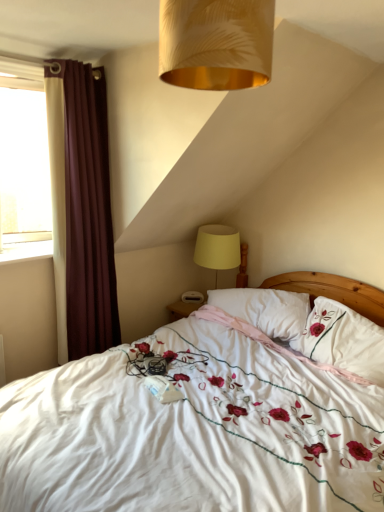
The height and width of the screenshot is (512, 384). Find the location of `white embroidered pillow at upper right, marked as the second pillow in a left-to-right arrangement`. white embroidered pillow at upper right, marked as the second pillow in a left-to-right arrangement is located at coordinates pos(343,340).

Find the location of a particular element. white soft pillow at center, acting as the 2th pillow starting from the right is located at coordinates (265, 309).

Describe the element at coordinates (216, 42) in the screenshot. The width and height of the screenshot is (384, 512). I see `gold textured lampshade at upper center` at that location.

Where is `white embroidered pillow at upper right, marked as the 1th pillow in a right-to-left arrangement`? The image size is (384, 512). white embroidered pillow at upper right, marked as the 1th pillow in a right-to-left arrangement is located at coordinates (343, 340).

I want to click on the 2nd pillow to the right when counting from the white glossy window sill at left, so click(x=343, y=340).

From a real-world perspective, which object stands above the other?

white glossy window sill at left, from a real-world perspective.

Is white glossy window sill at left aimed at white embroidered pillow at upper right, marked as the second pillow in a left-to-right arrangement?

No, white glossy window sill at left is not aimed at white embroidered pillow at upper right, marked as the second pillow in a left-to-right arrangement.

Looking at this image, in the image, is white glossy window sill at left positioned in front of or behind white embroidered pillow at upper right, marked as the 1th pillow in a right-to-left arrangement?

Visually, white glossy window sill at left is located behind white embroidered pillow at upper right, marked as the 1th pillow in a right-to-left arrangement.

From a real-world perspective, who is located lower, yellow fabric lampshade at upper right or white embroidered pillow at upper right, marked as the second pillow in a left-to-right arrangement?

white embroidered pillow at upper right, marked as the second pillow in a left-to-right arrangement.

Is yellow fabric lampshade at upper right oriented towards white embroidered pillow at upper right, marked as the second pillow in a left-to-right arrangement?

No, yellow fabric lampshade at upper right is not oriented towards white embroidered pillow at upper right, marked as the second pillow in a left-to-right arrangement.

From their relative heights in the image, would you say yellow fabric lampshade at upper right is taller or shorter than white embroidered pillow at upper right, marked as the 1th pillow in a right-to-left arrangement?

yellow fabric lampshade at upper right is taller than white embroidered pillow at upper right, marked as the 1th pillow in a right-to-left arrangement.

Do you think yellow fabric lampshade at upper right is within white embroidered pillow at upper right, marked as the second pillow in a left-to-right arrangement, or outside of it?

yellow fabric lampshade at upper right is outside white embroidered pillow at upper right, marked as the second pillow in a left-to-right arrangement.

Is gold textured lampshade at upper center directly adjacent to yellow fabric lampshade at upper right?

They are not placed beside each other.

From the image's perspective, who appears lower, gold textured lampshade at upper center or yellow fabric lampshade at upper right?

From the image's view, yellow fabric lampshade at upper right is below.

Is gold textured lampshade at upper center looking in the opposite direction of yellow fabric lampshade at upper right?

No, gold textured lampshade at upper center is not facing the opposite direction of yellow fabric lampshade at upper right.

Looking at the image, does gold textured lampshade at upper center seem bigger or smaller compared to yellow fabric lampshade at upper right?

Clearly, gold textured lampshade at upper center is smaller in size than yellow fabric lampshade at upper right.

Which object is further away from the camera, white embroidered pillow at upper right, marked as the 1th pillow in a right-to-left arrangement, or white soft pillow at center, acting as the 2th pillow starting from the right?

Positioned behind is white soft pillow at center, acting as the 2th pillow starting from the right.

From the image's perspective, which one is positioned higher, white embroidered pillow at upper right, marked as the second pillow in a left-to-right arrangement, or white soft pillow at center, acting as the 2th pillow starting from the right?

white soft pillow at center, acting as the 2th pillow starting from the right.

At what (x,y) coordinates should I click in order to perform the action: click on pillow below the white embroidered pillow at upper right, marked as the 1th pillow in a right-to-left arrangement (from a real-world perspective). Please return your answer as a coordinate pair (x, y). Image resolution: width=384 pixels, height=512 pixels. Looking at the image, I should click on (265, 309).

From a real-world perspective, who is located higher, white embroidered pillow at upper right, marked as the second pillow in a left-to-right arrangement, or white soft pillow at center, arranged as the first pillow when viewed from the left?

white embroidered pillow at upper right, marked as the second pillow in a left-to-right arrangement, is physically above.

From the image's perspective, which is below, white embroidered pillow at upper right, marked as the second pillow in a left-to-right arrangement, or yellow fabric lampshade at upper right?

white embroidered pillow at upper right, marked as the second pillow in a left-to-right arrangement, is shown below in the image.

From a real-world perspective, which object stands above the other?

From a 3D spatial view, yellow fabric lampshade at upper right is above.

Does point (355, 320) lie in front of point (238, 264)?

Yes, it is in front of point (238, 264).

Is white embroidered pillow at upper right, marked as the 1th pillow in a right-to-left arrangement, touching yellow fabric lampshade at upper right?

No, white embroidered pillow at upper right, marked as the 1th pillow in a right-to-left arrangement, is not with yellow fabric lampshade at upper right.

I want to click on the 2nd pillow to the right of the white embroidered fabric at center, counting from the anchor's position, so click(x=343, y=340).

Is there a large distance between white embroidered pillow at upper right, marked as the 1th pillow in a right-to-left arrangement, and white embroidered fabric at center?

Actually, white embroidered pillow at upper right, marked as the 1th pillow in a right-to-left arrangement, and white embroidered fabric at center are a little close together.

Could you tell me if white embroidered pillow at upper right, marked as the second pillow in a left-to-right arrangement, is facing white embroidered fabric at center?

Yes, white embroidered pillow at upper right, marked as the second pillow in a left-to-right arrangement, is turned towards white embroidered fabric at center.

Does point (352, 324) appear closer or farther from the camera than point (92, 387)?

Point (352, 324).

Is white embroidered pillow at upper right, marked as the second pillow in a left-to-right arrangement, not close to white glossy window sill at left?

Yes, white embroidered pillow at upper right, marked as the second pillow in a left-to-right arrangement, and white glossy window sill at left are quite far apart.

Considering the sizes of objects white embroidered pillow at upper right, marked as the second pillow in a left-to-right arrangement, and white glossy window sill at left in the image provided, who is taller, white embroidered pillow at upper right, marked as the second pillow in a left-to-right arrangement, or white glossy window sill at left?

white embroidered pillow at upper right, marked as the second pillow in a left-to-right arrangement, is taller.

Looking at the image, does white embroidered pillow at upper right, marked as the 1th pillow in a right-to-left arrangement, seem bigger or smaller compared to white glossy window sill at left?

white embroidered pillow at upper right, marked as the 1th pillow in a right-to-left arrangement, is bigger than white glossy window sill at left.

Is white embroidered pillow at upper right, marked as the 1th pillow in a right-to-left arrangement, facing towards white glossy window sill at left?

No, white embroidered pillow at upper right, marked as the 1th pillow in a right-to-left arrangement, is not oriented towards white glossy window sill at left.

Starting from the white glossy window sill at left, which pillow is the 2nd one to the right? Please provide its 2D coordinates.

[(343, 340)]

The image size is (384, 512). I want to click on table lamp on the left of white embroidered pillow at upper right, marked as the second pillow in a left-to-right arrangement, so click(x=217, y=247).

Based on their spatial positions, is yellow fabric lampshade at upper right or white soft pillow at center, arranged as the first pillow when viewed from the left, closer to white glossy window sill at left?

Among the two, yellow fabric lampshade at upper right is located nearer to white glossy window sill at left.

Which object lies nearer to the anchor point white embroidered fabric at center, yellow fabric lampshade at upper right or white soft pillow at center, arranged as the first pillow when viewed from the left?

white soft pillow at center, arranged as the first pillow when viewed from the left, is positioned closer to the anchor white embroidered fabric at center.

Based on their spatial positions, is white embroidered pillow at upper right, marked as the 1th pillow in a right-to-left arrangement, or white soft pillow at center, acting as the 2th pillow starting from the right, further from yellow fabric lampshade at upper right?

The object further to yellow fabric lampshade at upper right is white embroidered pillow at upper right, marked as the 1th pillow in a right-to-left arrangement.

Consider the image. When comparing their distances from white embroidered fabric at center, does white embroidered pillow at upper right, marked as the second pillow in a left-to-right arrangement, or white glossy window sill at left seem further?

Based on the image, white glossy window sill at left appears to be further to white embroidered fabric at center.

Which object lies further to the anchor point white embroidered fabric at center, white embroidered pillow at upper right, marked as the 1th pillow in a right-to-left arrangement, or white soft pillow at center, arranged as the first pillow when viewed from the left?

The object further to white embroidered fabric at center is white soft pillow at center, arranged as the first pillow when viewed from the left.

Considering their positions, is gold textured lampshade at upper center positioned closer to white embroidered pillow at upper right, marked as the second pillow in a left-to-right arrangement, than white embroidered fabric at center?

white embroidered fabric at center.

When comparing their distances from white embroidered pillow at upper right, marked as the 1th pillow in a right-to-left arrangement, does gold textured lampshade at upper center or maroon fabric curtain at left seem further?

gold textured lampshade at upper center lies further to white embroidered pillow at upper right, marked as the 1th pillow in a right-to-left arrangement, than the other object.

When comparing their distances from white glossy window sill at left, does yellow fabric lampshade at upper right or white embroidered pillow at upper right, marked as the second pillow in a left-to-right arrangement, seem closer?

yellow fabric lampshade at upper right is positioned closer to the anchor white glossy window sill at left.

What are the coordinates of `window sill between gold textured lampshade at upper center and white soft pillow at center, arranged as the first pillow when viewed from the left, in the front-back direction` in the screenshot? It's located at (26, 251).

This screenshot has height=512, width=384. What are the coordinates of `lamp located between white embroidered fabric at center and white soft pillow at center, acting as the 2th pillow starting from the right, in the depth direction` in the screenshot? It's located at (216, 42).

You are a GUI agent. You are given a task and a screenshot of the screen. Output one action in this format:
    pyautogui.click(x=<x>, y=<y>)
    Task: Click on the pillow between white embroidered fabric at center and white glossy window sill at left from front to back
    This screenshot has height=512, width=384.
    Given the screenshot: What is the action you would take?
    pyautogui.click(x=343, y=340)

In order to click on table lamp situated between maroon fabric curtain at left and white embroidered pillow at upper right, marked as the 1th pillow in a right-to-left arrangement, from left to right in this screenshot , I will do `click(217, 247)`.